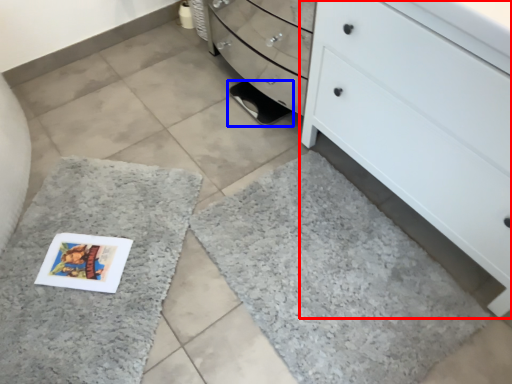
Question: Which object appears farthest to the camera in this image, chest of drawers (highlighted by a red box) or footwear (highlighted by a blue box)?

Choices:
 (A) chest of drawers
 (B) footwear

Answer: (B)